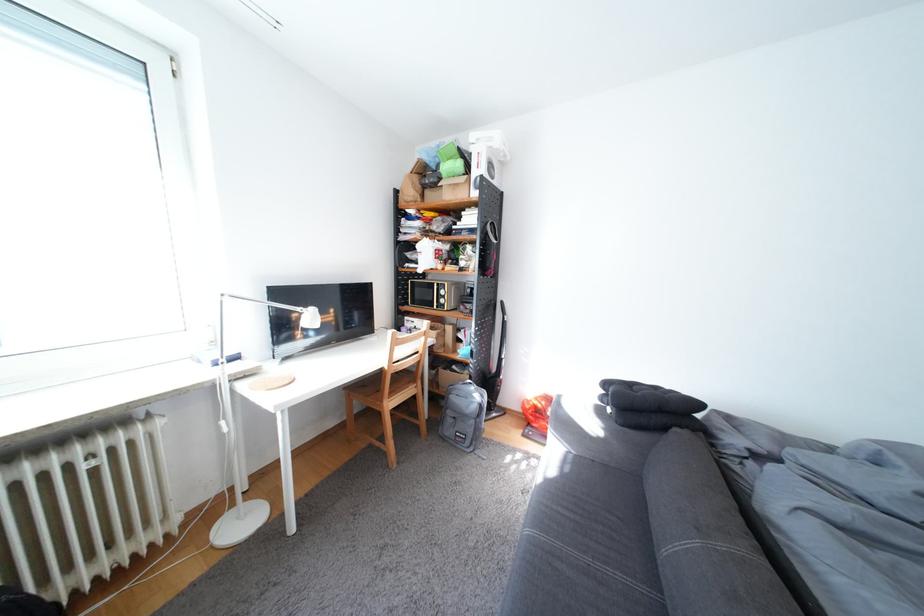
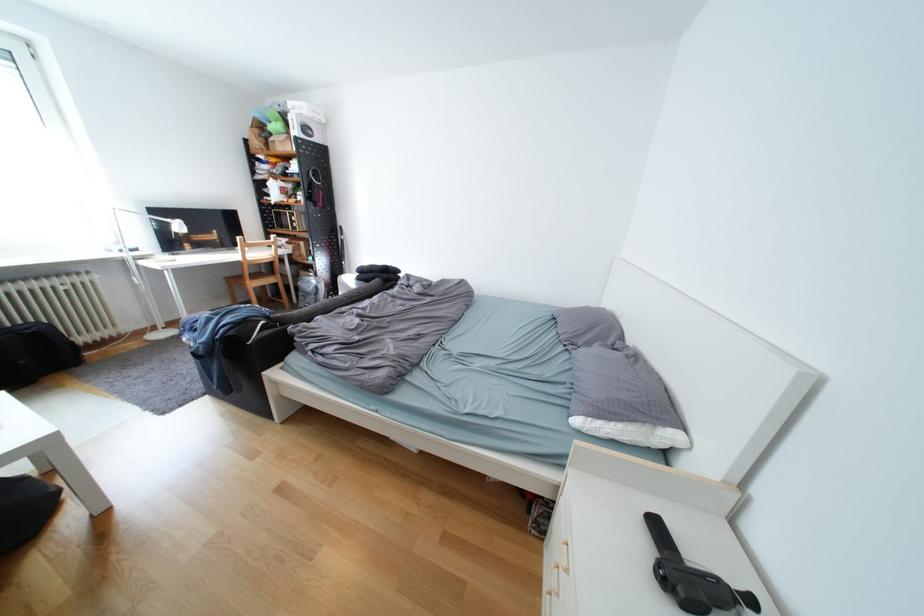
In the second image, find the point that corresponds to pixel 403 405 in the first image.

(265, 285)